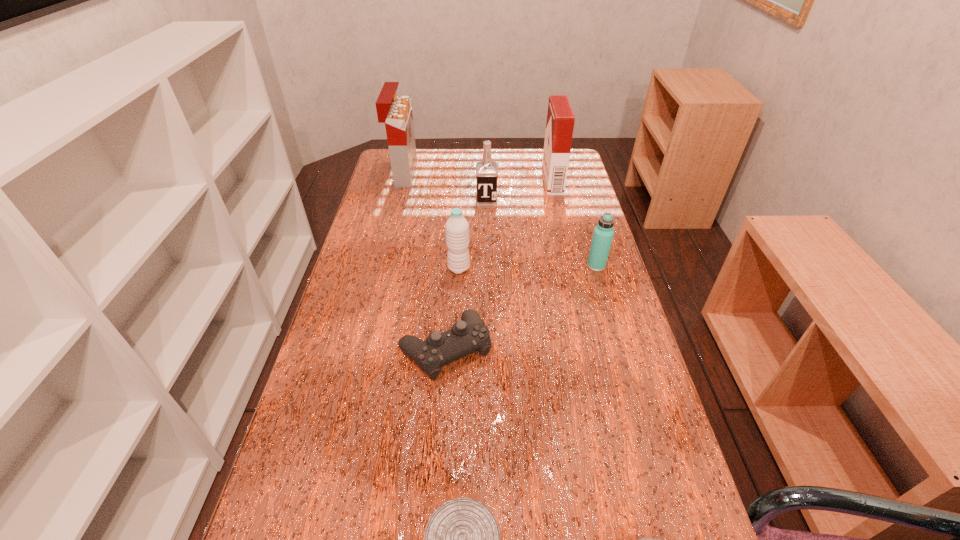
Select which object appears as the closest to the can. Please provide its 2D coordinates. Your answer should be formatted as a tuple, i.e. [(x, y)], where the tuple contains the x and y coordinates of a point satisfying the conditions above.

[(644, 539)]

This screenshot has width=960, height=540. I want to click on vacant area that satisfies the following two spatial constraints: 1. with the lid open on the thermos bottle; 2. on the left side of the left cigarette_case, so (381, 266).

The height and width of the screenshot is (540, 960). Find the location of `free space that satisfies the following two spatial constraints: 1. on the back side of the thermos bottle; 2. on the right side of the water bottle`. free space that satisfies the following two spatial constraints: 1. on the back side of the thermos bottle; 2. on the right side of the water bottle is located at coordinates (459, 266).

Identify the location of free spot that satisfies the following two spatial constraints: 1. on the front label of the thermos bottle; 2. on the left side of the sixth nearest object. (488, 266).

This screenshot has height=540, width=960. I want to click on free space that satisfies the following two spatial constraints: 1. with the lid open on the thermos bottle; 2. on the right side of the left cigarette_case, so click(381, 266).